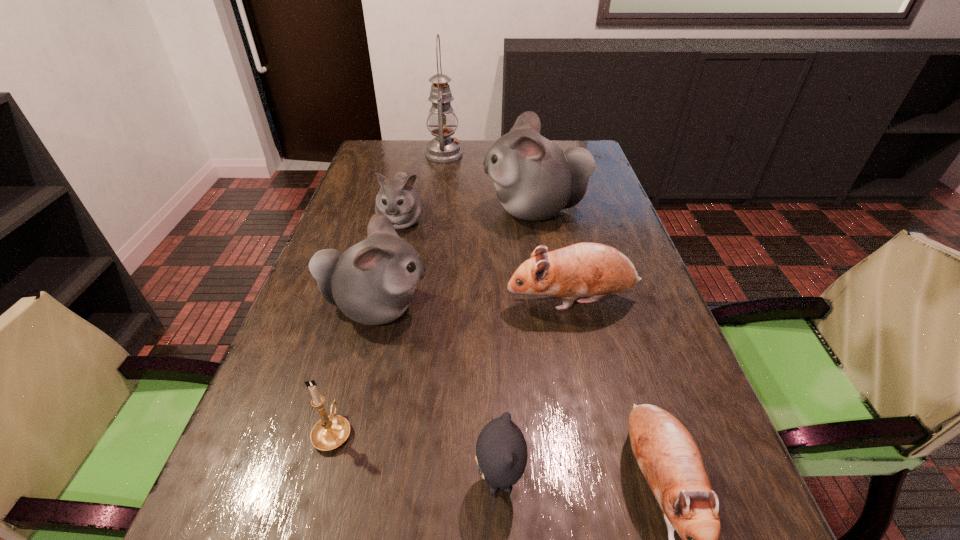
Identify the location of free point located on the handle side of the gold candle holder. (355, 349).

Where is `free point located 0.180m on the handle side of the gold candle holder`? free point located 0.180m on the handle side of the gold candle holder is located at coordinates (360, 334).

The image size is (960, 540). I want to click on vacant point located on the front-facing side of the gray kitten, so click(424, 481).

At what (x,y) coordinates should I click in order to perform the action: click on vacant area situated 0.260m on the front-facing side of the gray kitten. Please return your answer as a coordinate pair (x, y). The image size is (960, 540). Looking at the image, I should click on (310, 481).

What are the coordinates of `vacant space located 0.370m on the front-facing side of the gray kitten` in the screenshot? It's located at [240, 481].

Where is `object that is at the far edge`? The width and height of the screenshot is (960, 540). object that is at the far edge is located at coordinates (442, 120).

Locate an element on the screen. candle holder that is at the left edge is located at coordinates (330, 432).

Image resolution: width=960 pixels, height=540 pixels. What are the coordinates of `free space at the far edge of the desktop` in the screenshot? It's located at (414, 145).

This screenshot has height=540, width=960. I want to click on vacant space at the left edge of the desktop, so pos(363,207).

In the image, there is a desktop. Where is `vacant space at the right edge`? The image size is (960, 540). vacant space at the right edge is located at coordinates (650, 308).